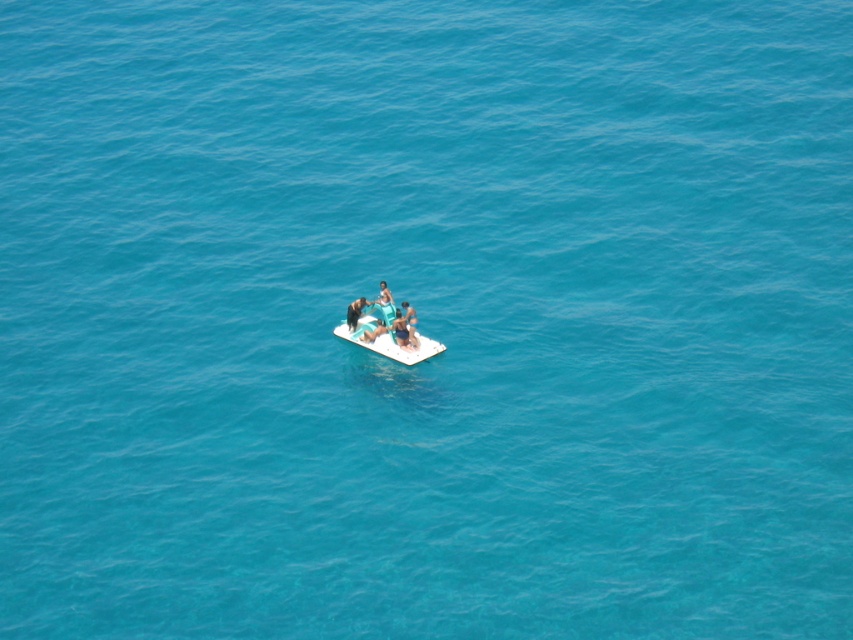
Question: Which of the following is the closest to the observer?

Choices:
 (A) smooth skin person at center
 (B) matte teal surfboard at center
 (C) smooth blue shorts at center

Answer: (B)

Question: Which object is the farthest from the white plastic raft at center?

Choices:
 (A) smooth blue shorts at center
 (B) blue fabric person at center
 (C) matte teal surfboard at center
 (D) smooth skin person at center

Answer: (B)

Question: Which object is positioned farthest from the smooth blue shorts at center?

Choices:
 (A) white plastic raft at center
 (B) blue fabric person at center

Answer: (B)

Question: Is the position of white plastic raft at center less distant than that of smooth blue shorts at center?

Choices:
 (A) yes
 (B) no

Answer: (A)

Question: From the image, what is the correct spatial relationship of smooth skin person at center in relation to blue fabric person at center?

Choices:
 (A) right
 (B) left

Answer: (B)

Question: Is the position of white plastic raft at center more distant than that of smooth blue shorts at center?

Choices:
 (A) no
 (B) yes

Answer: (A)